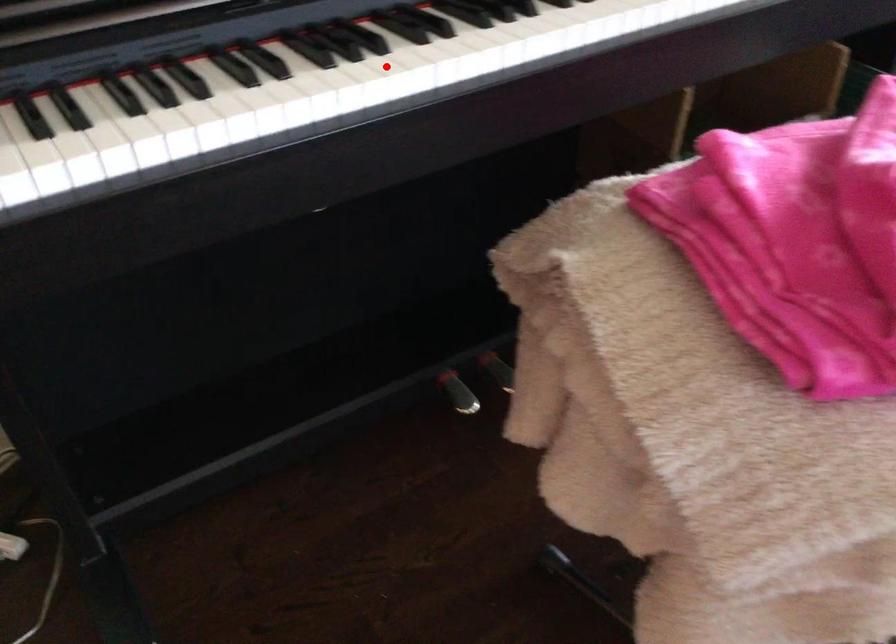
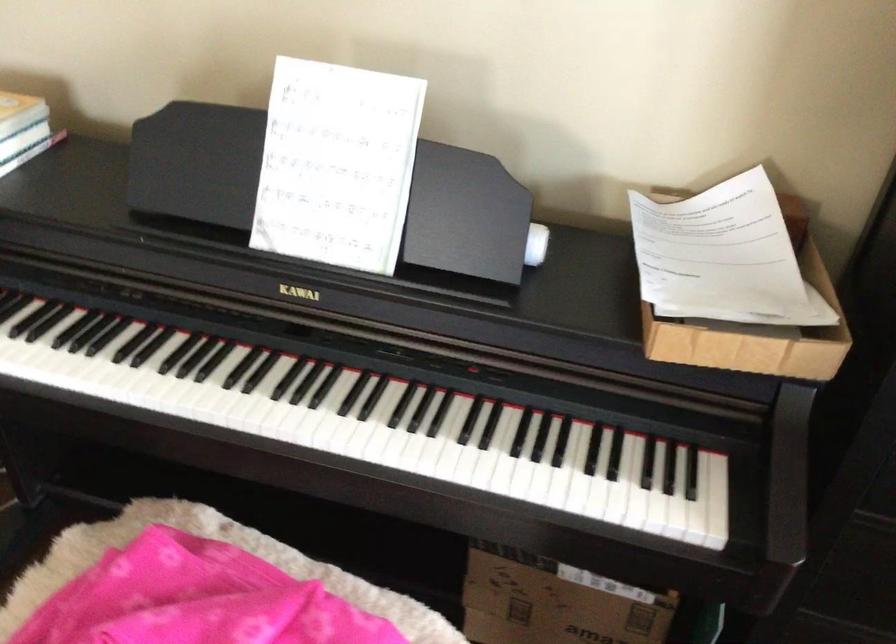
Question: I am providing you with two images of the same scene from different viewpoints. Image1 has a red point marked. In image2, the corresponding 3D location appears at what relative position? Reply with the corresponding letter.

Choices:
 (A) Closer
 (B) Farther

Answer: (B)